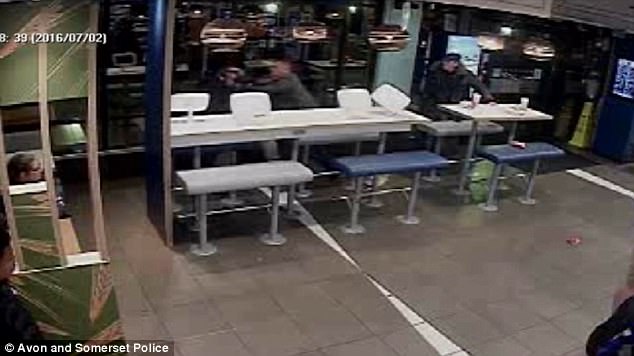
Locate an element on the screen. Image resolution: width=634 pixels, height=356 pixels. table is located at coordinates (294, 117), (496, 113).